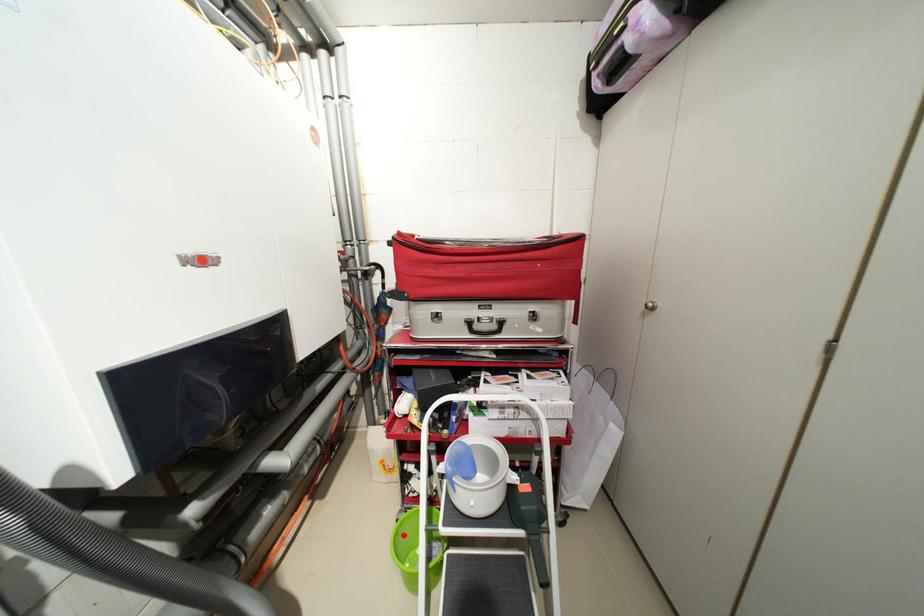
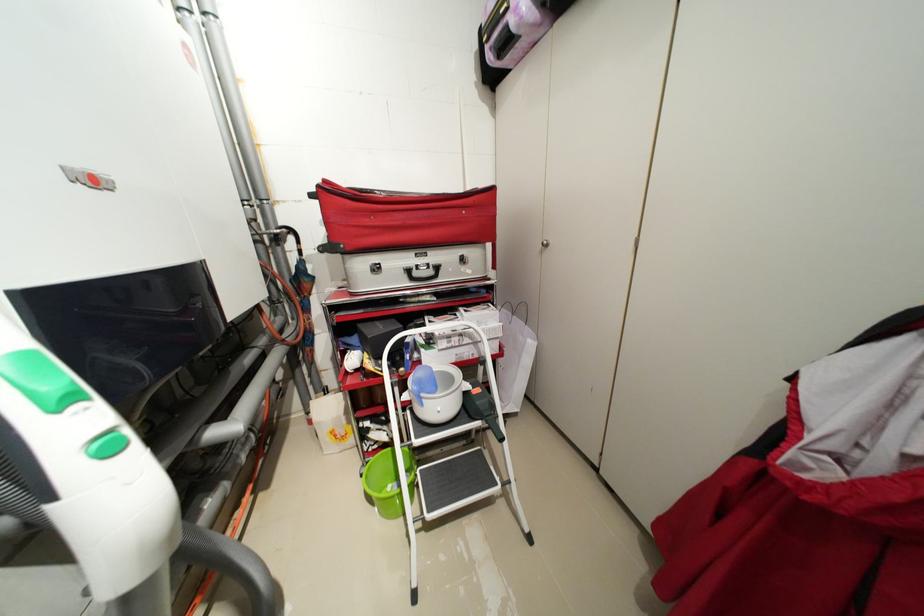
Find the pixel in the second image that matches the highlighted location in the first image.

(373, 479)